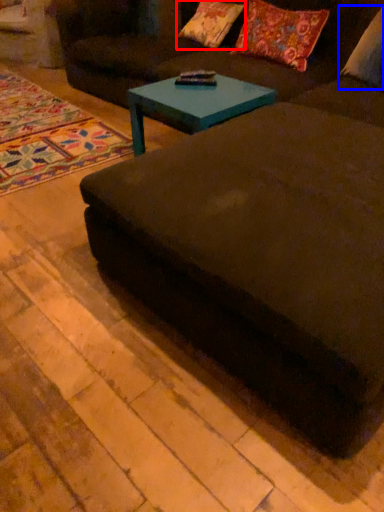
Question: Among these objects, which one is farthest to the camera, pillow (highlighted by a red box) or pillow (highlighted by a blue box)?

Choices:
 (A) pillow
 (B) pillow

Answer: (A)